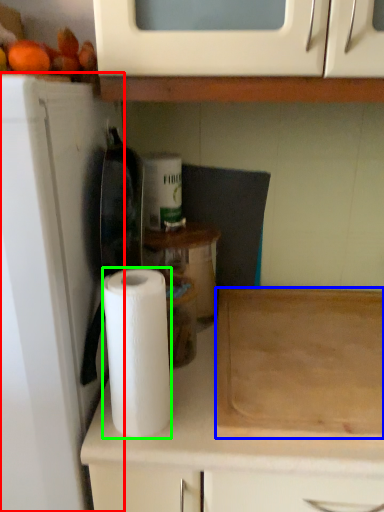
Question: Which object is positioned farthest from appliance (highlighted by a red box)? Select from cutting board (highlighted by a blue box) and paper towel (highlighted by a green box).

Choices:
 (A) cutting board
 (B) paper towel

Answer: (A)